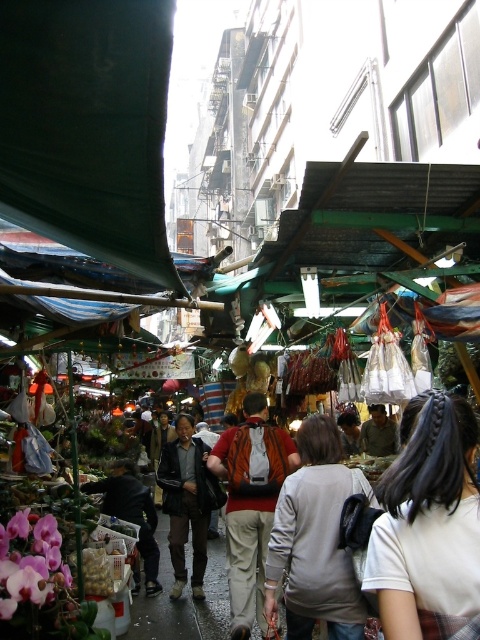
What are the coordinates of the dark green fabric canopy at upper left?

The dark green fabric canopy at upper left is located at coordinates point (87, 125).

You are a customer standing at the entrance of the market. You see the dark green fabric canopy at upper left and another stall to its right. How far apart are these two stalls?

The dark green fabric canopy at upper left and the stall to its right are 7.89 feet apart.

You are a customer at the market and see both the dark green fabric canopy at upper left and the dark brown leather jacket at center. Which object is positioned to the right of the other?

The dark green fabric canopy at upper left is to the right of the dark brown leather jacket at center.